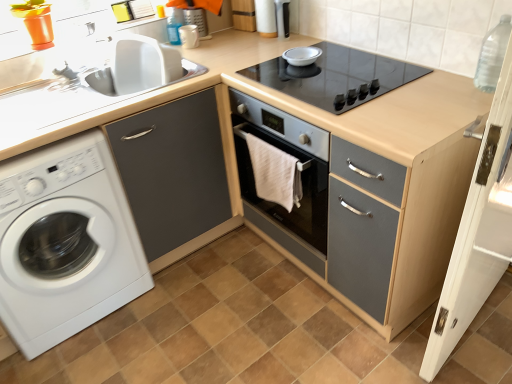
Question: Considering the relative positions of transparent plastic bottle at upper right and black glass cooktop at center in the image provided, is transparent plastic bottle at upper right to the right of black glass cooktop at center from the viewer's perspective?

Choices:
 (A) yes
 (B) no

Answer: (A)

Question: Is transparent plastic bottle at upper right shorter than black glass cooktop at center?

Choices:
 (A) no
 (B) yes

Answer: (A)

Question: Does transparent plastic bottle at upper right have a larger size compared to black glass cooktop at center?

Choices:
 (A) yes
 (B) no

Answer: (B)

Question: Is transparent plastic bottle at upper right oriented towards black glass cooktop at center?

Choices:
 (A) no
 (B) yes

Answer: (A)

Question: Does transparent plastic bottle at upper right have a lesser width compared to black glass cooktop at center?

Choices:
 (A) no
 (B) yes

Answer: (B)

Question: From the image's perspective, is transparent plastic bottle at upper right below black glass cooktop at center?

Choices:
 (A) yes
 (B) no

Answer: (A)

Question: Considering the relative sizes of matte white mug at upper center, the second appliance when ordered from right to left, and white wood screen door at right in the image provided, is matte white mug at upper center, the second appliance when ordered from right to left, shorter than white wood screen door at right?

Choices:
 (A) yes
 (B) no

Answer: (A)

Question: Is matte white mug at upper center, the second appliance when ordered from right to left, to the left of white wood screen door at right from the viewer's perspective?

Choices:
 (A) no
 (B) yes

Answer: (B)

Question: Does matte white mug at upper center, marked as the 1th appliance in a left-to-right arrangement, contain white wood screen door at right?

Choices:
 (A) yes
 (B) no

Answer: (B)

Question: From the image's perspective, would you say matte white mug at upper center, the second appliance when ordered from right to left, is shown under white wood screen door at right?

Choices:
 (A) no
 (B) yes

Answer: (A)

Question: Is matte white mug at upper center, marked as the 1th appliance in a left-to-right arrangement, at the right side of white wood screen door at right?

Choices:
 (A) yes
 (B) no

Answer: (B)

Question: Does matte white mug at upper center, marked as the 1th appliance in a left-to-right arrangement, have a larger size compared to white wood screen door at right?

Choices:
 (A) yes
 (B) no

Answer: (B)

Question: Does white matte washing machine at left have a greater height compared to matte gray cabinet at center?

Choices:
 (A) yes
 (B) no

Answer: (B)